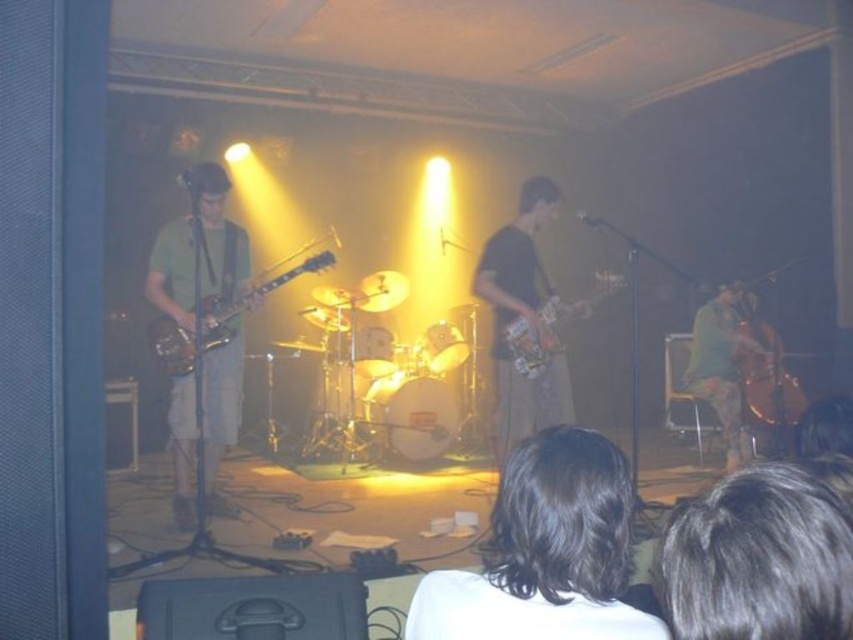
You are a photographer positioned at the back of the venue. You want to take a photo of the two guitarists. Which guitarist, the one at point (838, 548) or the one at (778, 388), is closer to the camera?

The guitarist at point (838, 548) is closer to the camera because point (838, 548) is in front of point (778, 388).

Based on the scene description, which object is narrower in width between the dark brown hair at lower center and the matte green shirt at left?

The dark brown hair at lower center is thinner than the matte green shirt at left, so it is narrower in width.